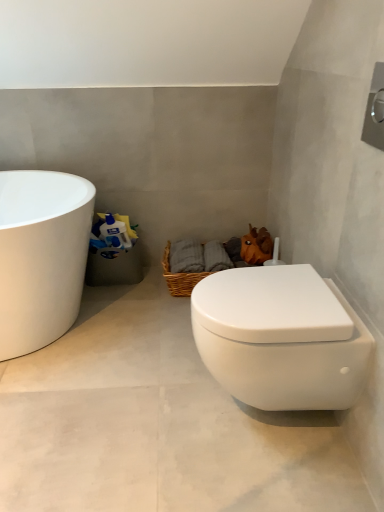
Question: Does white matte toilet at lower right touch woven brown basket at center?

Choices:
 (A) no
 (B) yes

Answer: (A)

Question: From the image's perspective, is white matte toilet at lower right under woven brown basket at center?

Choices:
 (A) no
 (B) yes

Answer: (B)

Question: Is white matte toilet at lower right shorter than woven brown basket at center?

Choices:
 (A) no
 (B) yes

Answer: (B)

Question: From a real-world perspective, is white matte toilet at lower right on woven brown basket at center?

Choices:
 (A) yes
 (B) no

Answer: (B)

Question: Does white matte toilet at lower right have a greater width compared to woven brown basket at center?

Choices:
 (A) yes
 (B) no

Answer: (A)

Question: Is white matte toilet at lower right far away from woven brown basket at center?

Choices:
 (A) no
 (B) yes

Answer: (A)

Question: Considering the relative sizes of orange matte plush toy at upper right and white matte toilet at lower right in the image provided, is orange matte plush toy at upper right bigger than white matte toilet at lower right?

Choices:
 (A) yes
 (B) no

Answer: (B)

Question: Would you say orange matte plush toy at upper right contains white matte toilet at lower right?

Choices:
 (A) yes
 (B) no

Answer: (B)

Question: Is orange matte plush toy at upper right positioned with its back to white matte toilet at lower right?

Choices:
 (A) no
 (B) yes

Answer: (A)

Question: Is the surface of orange matte plush toy at upper right in direct contact with white matte toilet at lower right?

Choices:
 (A) yes
 (B) no

Answer: (B)

Question: Can you confirm if orange matte plush toy at upper right is wider than white matte toilet at lower right?

Choices:
 (A) yes
 (B) no

Answer: (B)

Question: Does orange matte plush toy at upper right lie behind white matte toilet at lower right?

Choices:
 (A) no
 (B) yes

Answer: (B)

Question: Is white matte toilet at lower right at the back of white glossy toilet at lower right?

Choices:
 (A) no
 (B) yes

Answer: (A)